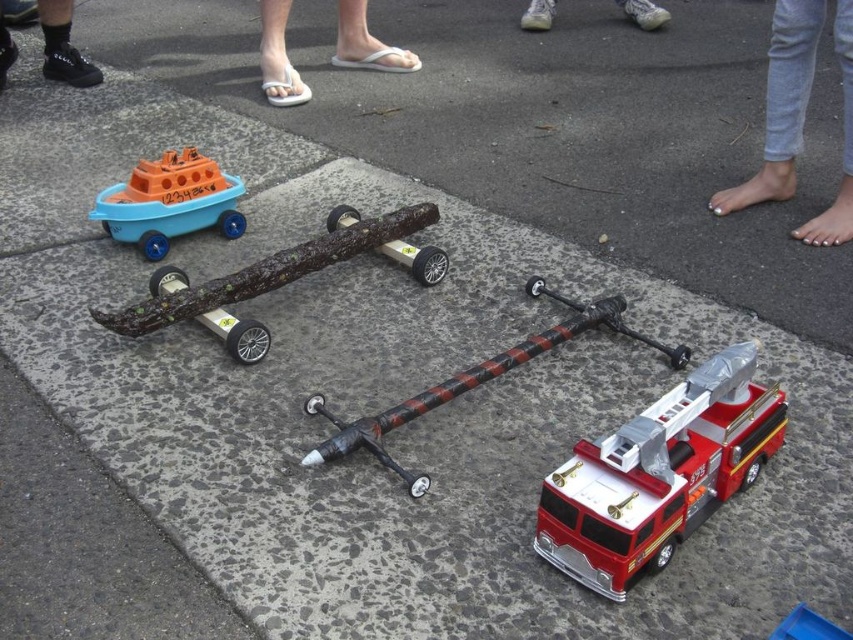
Does point (585, 572) lie behind point (541, 17)?

No.

What do you see at coordinates (659, 474) in the screenshot?
I see `shiny metallic fire truck at lower right` at bounding box center [659, 474].

Locate an element on the screen. shiny metallic fire truck at lower right is located at coordinates (659, 474).

Who is more forward, (798, 83) or (585, 321)?

Point (585, 321) is more forward.

Which is below, gray denim jeans at upper right or plastic/toy sword at center?

Positioned lower is plastic/toy sword at center.

Who is more distant from viewer, (x=848, y=83) or (x=405, y=470)?

The point (x=848, y=83) is behind.

I want to click on gray denim jeans at upper right, so click(x=781, y=106).

Where is `matte blue plastic boat at upper left`? Image resolution: width=853 pixels, height=640 pixels. matte blue plastic boat at upper left is located at coordinates (169, 202).